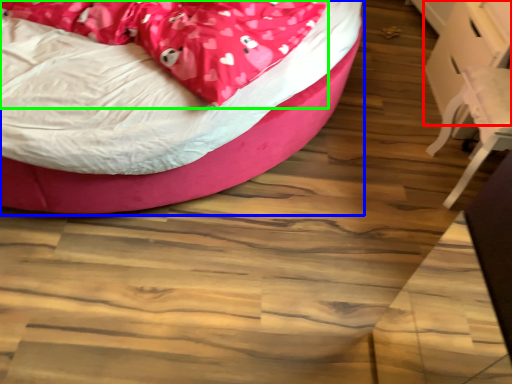
Question: Estimate the real-world distances between objects in this image. Which object is farther from table (highlighted by a red box), bed (highlighted by a blue box) or blanket (highlighted by a green box)?

Choices:
 (A) bed
 (B) blanket

Answer: (B)